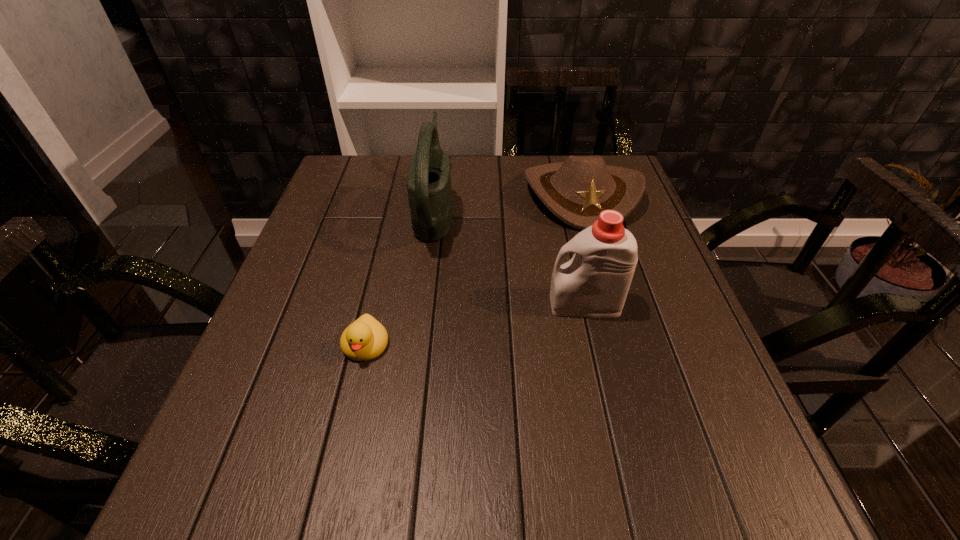
Where is `the second object from left to right`? Image resolution: width=960 pixels, height=540 pixels. the second object from left to right is located at coordinates (428, 183).

Find the location of a particular element. The image size is (960, 540). detergent is located at coordinates (594, 284).

I want to click on the second shortest object, so click(x=576, y=191).

This screenshot has width=960, height=540. Find the location of `duckling`. duckling is located at coordinates (365, 339).

Find the location of a particular element. The image size is (960, 540). the nearest object is located at coordinates (365, 339).

Locate an element on the screen. The width and height of the screenshot is (960, 540). vacant area situated 0.300m on the spout of the watering can is located at coordinates (570, 209).

The height and width of the screenshot is (540, 960). What are the coordinates of `vacant space located 0.200m on the handle side of the detergent` in the screenshot? It's located at (449, 305).

Locate an element on the screen. The width and height of the screenshot is (960, 540). free space located 0.050m on the handle side of the detergent is located at coordinates (524, 305).

You are a GUI agent. You are given a task and a screenshot of the screen. Output one action in this format:
    pyautogui.click(x=<x>, y=<y>)
    Task: Click on the free space located 0.200m on the handle side of the detergent
    This screenshot has height=540, width=960.
    Given the screenshot: What is the action you would take?
    pyautogui.click(x=449, y=305)

In order to click on vacant space located 0.250m with a star on the front of the cowboy hat in this screenshot , I will do pyautogui.click(x=614, y=309).